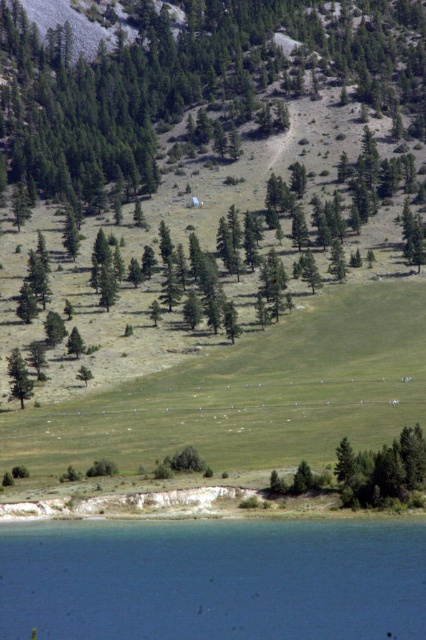
Does blue liquid water at lower center have a greater height compared to green matte tree at left?

No, blue liquid water at lower center is not taller than green matte tree at left.

Looking at this image, is blue liquid water at lower center above green matte tree at left?

Actually, blue liquid water at lower center is below green matte tree at left.

This screenshot has height=640, width=426. What are the coordinates of `blue liquid water at lower center` in the screenshot? It's located at coord(213,579).

At what (x,y) coordinates should I click in order to perform the action: click on green leafy tree at center. Please return your answer as a coordinate pair (x, y). This screenshot has width=426, height=640. Looking at the image, I should click on (198, 157).

I want to click on green leafy tree at center, so click(198, 157).

Does green leafy tree at center appear on the right side of blue liquid water at lower center?

Answer: Yes, green leafy tree at center is to the right of blue liquid water at lower center.

Image resolution: width=426 pixels, height=640 pixels. I want to click on green leafy tree at center, so click(198, 157).

This screenshot has width=426, height=640. What are the coordinates of `green leafy tree at center` in the screenshot? It's located at (198, 157).